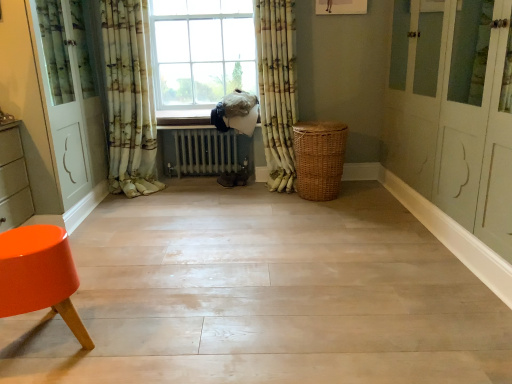
Question: Is orange glossy stool at lower left closer to the viewer compared to patterned fabric curtain at center, acting as the third curtain starting from the left?

Choices:
 (A) yes
 (B) no

Answer: (A)

Question: Is orange glossy stool at lower left not close to patterned fabric curtain at center, which is counted as the 1th curtain, starting from the right?

Choices:
 (A) no
 (B) yes

Answer: (B)

Question: Considering the relative sizes of orange glossy stool at lower left and patterned fabric curtain at center, which is counted as the 1th curtain, starting from the right, in the image provided, is orange glossy stool at lower left wider than patterned fabric curtain at center, which is counted as the 1th curtain, starting from the right,?

Choices:
 (A) yes
 (B) no

Answer: (A)

Question: Does orange glossy stool at lower left contain patterned fabric curtain at center, which is counted as the 1th curtain, starting from the right?

Choices:
 (A) no
 (B) yes

Answer: (A)

Question: Is orange glossy stool at lower left at the right side of patterned fabric curtain at center, which is counted as the 1th curtain, starting from the right?

Choices:
 (A) no
 (B) yes

Answer: (A)

Question: Considering the positions of point (200, 125) and point (39, 6), is point (200, 125) closer or farther from the camera than point (39, 6)?

Choices:
 (A) farther
 (B) closer

Answer: (A)

Question: Considering the positions of wooden at center and green floral fabric curtain at left, marked as the 1th curtain in a left-to-right arrangement, in the image, is wooden at center wider or thinner than green floral fabric curtain at left, marked as the 1th curtain in a left-to-right arrangement,?

Choices:
 (A) thin
 (B) wide

Answer: (B)

Question: In the image, is wooden at center positioned in front of or behind green floral fabric curtain at left, which appears as the 3th curtain when viewed from the right?

Choices:
 (A) front
 (B) behind

Answer: (B)

Question: From the image's perspective, is wooden at center above or below green floral fabric curtain at left, which appears as the 3th curtain when viewed from the right?

Choices:
 (A) below
 (B) above

Answer: (B)

Question: Considering the positions of point (87, 87) and point (305, 130), is point (87, 87) closer or farther from the camera than point (305, 130)?

Choices:
 (A) closer
 (B) farther

Answer: (B)

Question: Is green floral fabric curtain at left, marked as the 1th curtain in a left-to-right arrangement, bigger or smaller than woven brown basket at center?

Choices:
 (A) big
 (B) small

Answer: (A)

Question: From a real-world perspective, relative to woven brown basket at center, is green floral fabric curtain at left, which appears as the 3th curtain when viewed from the right, vertically above or below?

Choices:
 (A) above
 (B) below

Answer: (A)

Question: Based on their positions, is green floral fabric curtain at left, marked as the 1th curtain in a left-to-right arrangement, located to the left or right of woven brown basket at center?

Choices:
 (A) right
 (B) left

Answer: (B)

Question: Is point (73, 175) positioned closer to the camera than point (282, 64)?

Choices:
 (A) farther
 (B) closer

Answer: (B)

Question: Is green floral fabric curtain at left, marked as the 1th curtain in a left-to-right arrangement, bigger or smaller than patterned fabric curtain at center, acting as the third curtain starting from the left?

Choices:
 (A) small
 (B) big

Answer: (B)